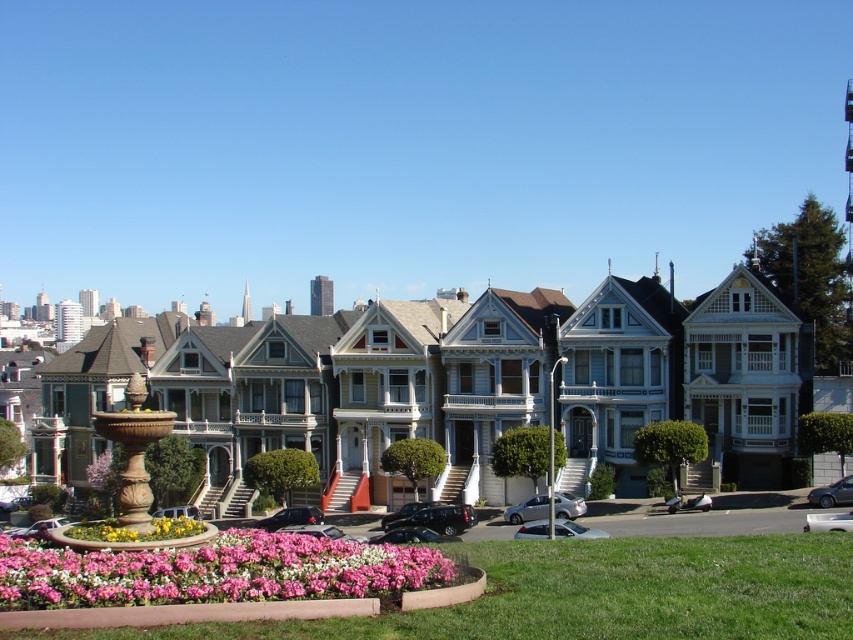
Does pink floral bed at lower center have a smaller size compared to marble fountain at center left?

Indeed, pink floral bed at lower center has a smaller size compared to marble fountain at center left.

Looking at this image, is pink floral bed at lower center further to the viewer compared to marble fountain at center left?

No, pink floral bed at lower center is in front of marble fountain at center left.

Between point (287, 540) and point (141, 465), which one is positioned in front?

Positioned in front is point (287, 540).

At what (x,y) coordinates should I click in order to perform the action: click on pink floral bed at lower center. Please return your answer as a coordinate pair (x, y). This screenshot has width=853, height=640. Looking at the image, I should click on (216, 572).

This screenshot has height=640, width=853. What do you see at coordinates (216, 572) in the screenshot?
I see `pink floral bed at lower center` at bounding box center [216, 572].

Where is `pink floral bed at lower center`? pink floral bed at lower center is located at coordinates (216, 572).

Can you confirm if marble fountain at center left is bigger than floral mosaic at center?

Yes.

This screenshot has width=853, height=640. What do you see at coordinates (134, 477) in the screenshot?
I see `marble fountain at center left` at bounding box center [134, 477].

The width and height of the screenshot is (853, 640). I want to click on marble fountain at center left, so click(134, 477).